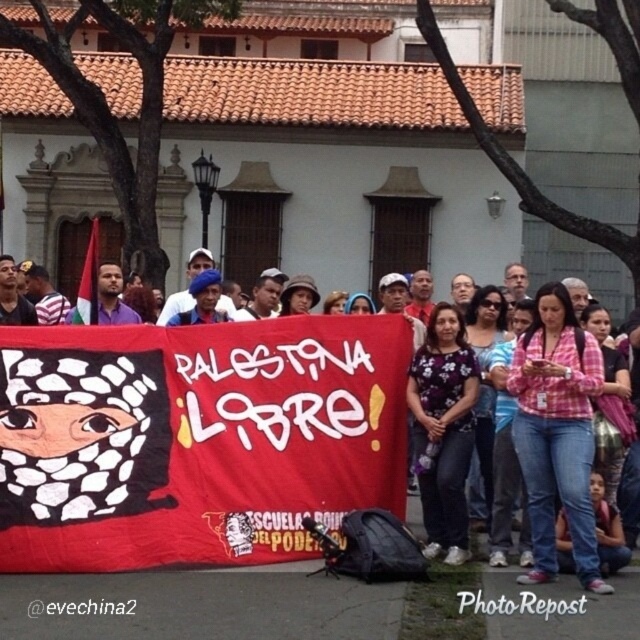
You are a photographer at the event and need to capture both the pink plaid shirt at center and the pink checkered shirt at center in a single frame. Which shirt should you focus on to ensure both are visible without cropping?

The pink plaid shirt at center is taller than the pink checkered shirt at center, so focusing on the pink plaid shirt at center will ensure both are visible without cropping.

You are a photographer standing at the camera position. You want to capture a closeup shot of the pink plaid shirt at center. Considering the distance, is it possible to do so with a standard camera lens without moving closer?

The pink plaid shirt at center is 24.59 meters away from the camera. A standard camera lens typically has a maximum focal length of around 200mm, which allows for capturing details at distances up to approximately 20 meters. Therefore, it would be challenging to get a clear closeup without moving closer or using a telephoto lens with a longer focal length.

Looking at the crowd holding the banner, which person is positioned to the left of the other between the pink plaid shirt at center and the purple floral shirt at center?

The pink plaid shirt at center is positioned to the left of the purple floral shirt at center.